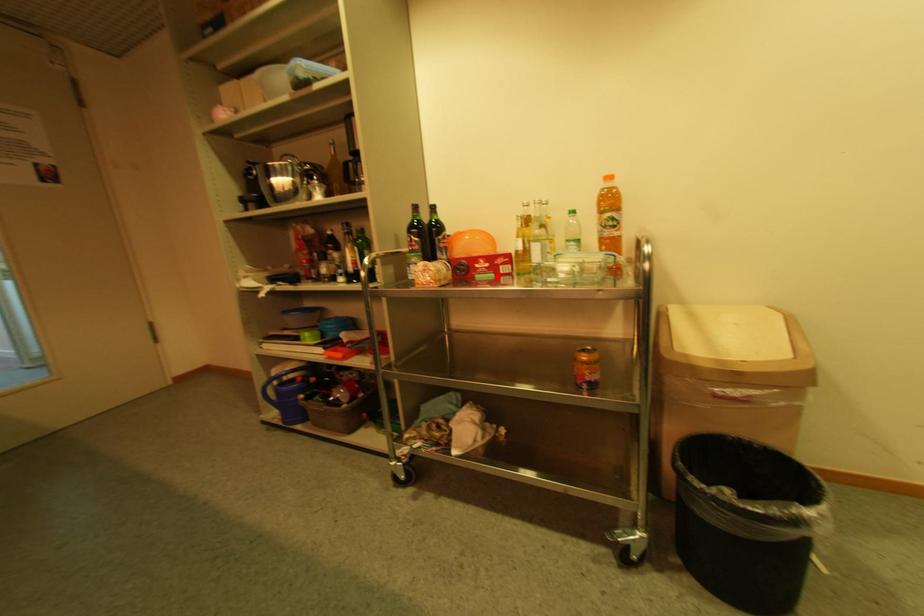
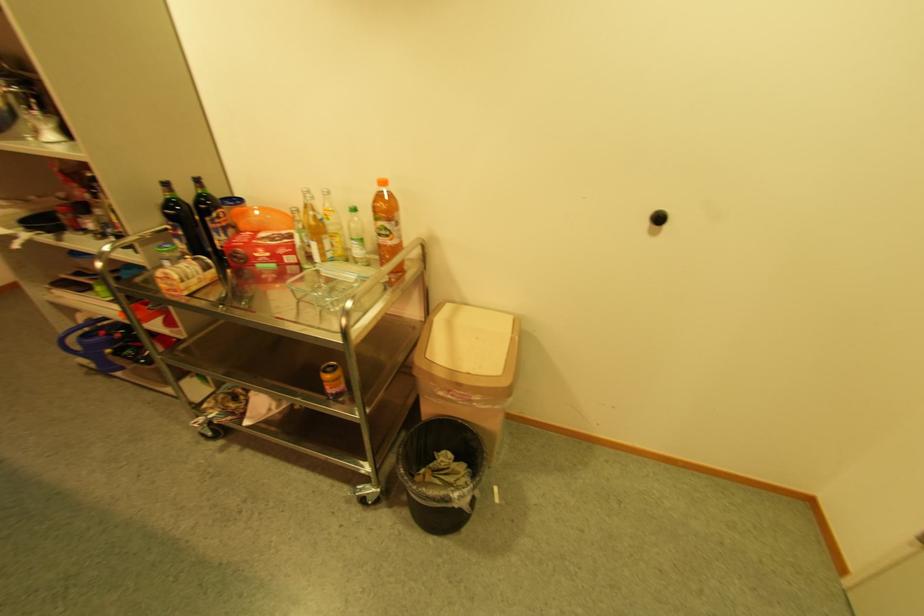
The point at the highlighted location is marked in the first image. Where is the corresponding point in the second image?

(278, 267)